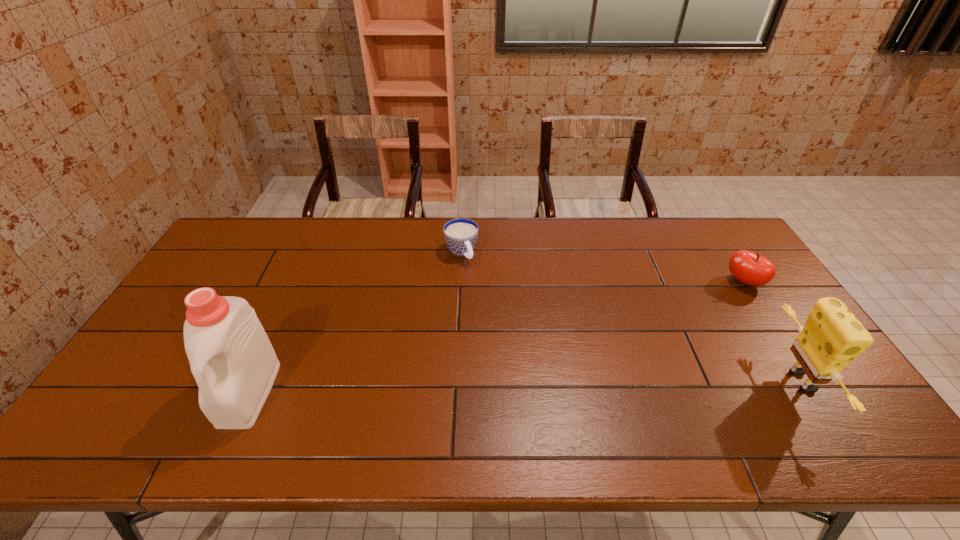
At what (x,y) coordinates should I click in order to perform the action: click on vacant space at the near edge of the desktop. Please return your answer as a coordinate pair (x, y). Looking at the image, I should click on (453, 404).

This screenshot has height=540, width=960. Find the location of `free space at the left edge of the desktop`. free space at the left edge of the desktop is located at coordinates (225, 264).

You are a GUI agent. You are given a task and a screenshot of the screen. Output one action in this format:
    pyautogui.click(x=<x>, y=<y>)
    Task: Click on the free space at the right edge of the desktop
    This screenshot has height=540, width=960.
    Given the screenshot: What is the action you would take?
    pyautogui.click(x=767, y=336)

At what (x,y) coordinates should I click in order to perform the action: click on free space at the far right corner of the desktop. Please return your answer as a coordinate pair (x, y). The height and width of the screenshot is (540, 960). Looking at the image, I should click on (731, 237).

Identify the location of empty space between the third shortest object and the farthest object. This screenshot has height=540, width=960. (632, 317).

Where is `vacant space in between the second tallest object and the farthest object`? This screenshot has width=960, height=540. vacant space in between the second tallest object and the farthest object is located at coordinates pyautogui.click(x=632, y=317).

This screenshot has width=960, height=540. In order to click on unoccupied position between the sponge and the second shortest object in this screenshot , I will do `click(773, 332)`.

The image size is (960, 540). In order to click on free point between the apple and the leftmost object in this screenshot , I will do `click(496, 338)`.

Identify the location of vacant area that lies between the detergent and the third shortest object. (526, 387).

The width and height of the screenshot is (960, 540). I want to click on free space between the leftmost object and the cup, so click(355, 322).